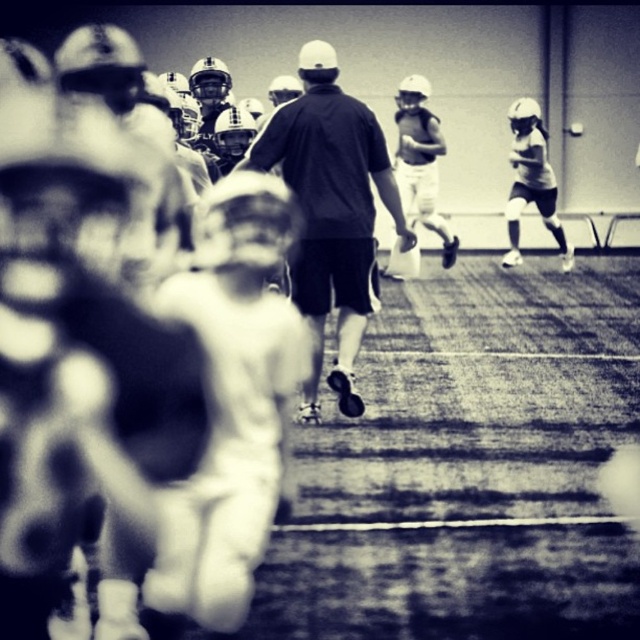
Question: Which point is closer to the camera?

Choices:
 (A) (401, 172)
 (B) (368, 168)

Answer: (B)

Question: Which is nearer to the smooth white tank top at center?

Choices:
 (A) black matte shirt at center
 (B) white matte shorts at right

Answer: (B)

Question: Where is black matte shirt at center located in relation to smooth white tank top at center in the image?

Choices:
 (A) above
 (B) below

Answer: (B)

Question: Among these objects, which one is farthest from the camera?

Choices:
 (A) white matte shorts at right
 (B) black matte shirt at center
 (C) smooth white tank top at center

Answer: (C)

Question: Does black matte shirt at center lie behind smooth white tank top at center?

Choices:
 (A) no
 (B) yes

Answer: (A)

Question: Can you confirm if smooth white tank top at center is smaller than white matte shorts at right?

Choices:
 (A) no
 (B) yes

Answer: (B)